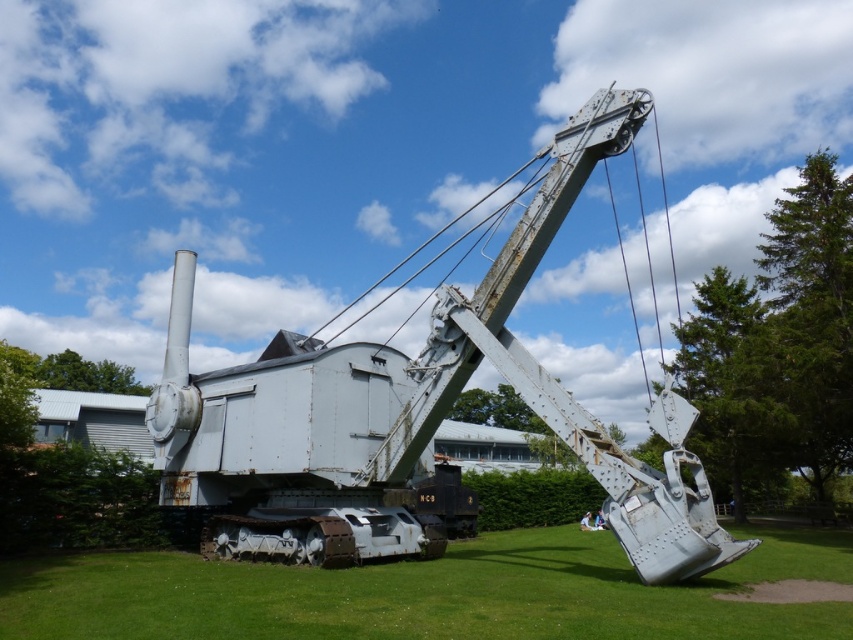
You are a construction worker who needs to move a heavy object. You see the rusty metal excavator at center and the green grass at lower center. Which object can you use to move the heavy object?

The rusty metal excavator at center can be used to move the heavy object because it is a construction equipment designed for such tasks, while the green grass at lower center is just a natural ground cover and cannot be used for moving heavy objects.

From the picture: You are a construction worker needing to park a new equipment that is 3 meters wide. You see the rusty metal excavator at center and the green grass at lower center. Which area can accommodate the new equipment based on their widths?

The green grass at lower center has a greater width than the rusty metal excavator at center, so the new equipment can be parked on the green grass at lower center since it is wider.

You are standing 5 meters away from a rusty metal excavator at center. If you walk directly towards it for 3 meters, will you be able to touch it?

The rusty metal excavator at center is 7.92 meters away from the viewer. After walking 3 meters towards it, you will be 4.92 meters away, so you cannot touch it.